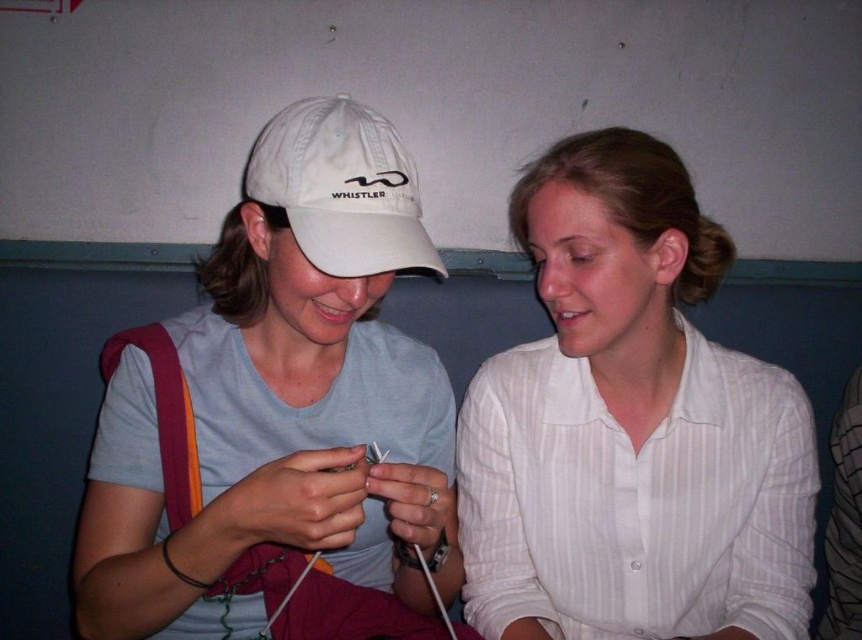
Question: Does white striped shirt at center appear on the left side of white fabric baseball cap at center?

Choices:
 (A) no
 (B) yes

Answer: (A)

Question: Which point appears farthest from the camera in this image?

Choices:
 (A) (678, 323)
 (B) (316, 294)
 (C) (389, 140)

Answer: (A)

Question: Does white striped shirt at center have a greater width compared to white fabric baseball cap at center?

Choices:
 (A) yes
 (B) no

Answer: (A)

Question: Is white striped shirt at center wider than white fabric baseball cap at center?

Choices:
 (A) no
 (B) yes

Answer: (B)

Question: Which of the following is the farthest from the observer?

Choices:
 (A) white striped shirt at center
 (B) white fabric baseball cap at center

Answer: (A)

Question: Based on their relative distances, which object is nearer to the white cotton cap at upper left?

Choices:
 (A) white striped shirt at center
 (B) white fabric baseball cap at center

Answer: (B)